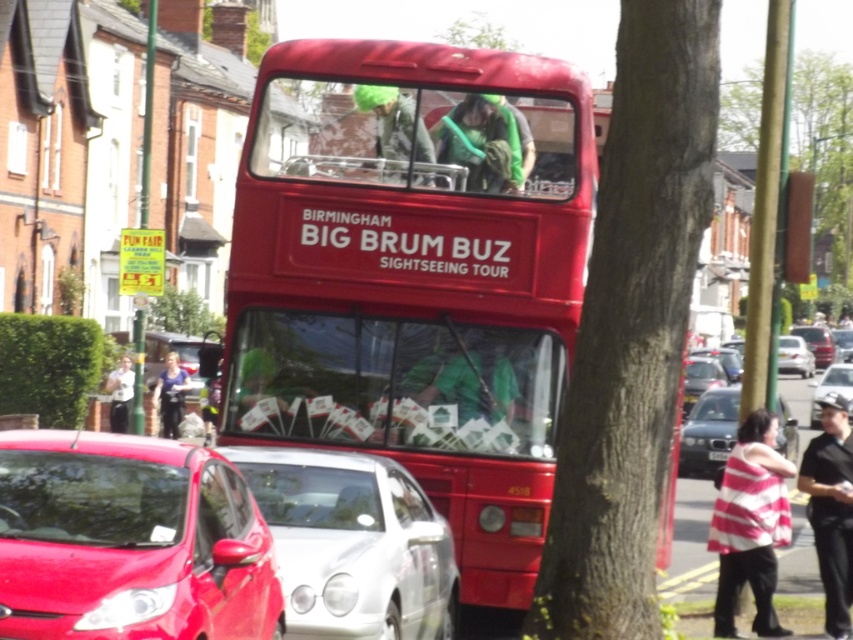
Question: Which is farther from the shiny silver car at center?

Choices:
 (A) metallic silver sedan at center
 (B) green leafy tree at center
 (C) shiny red bus at center

Answer: (B)

Question: Does silver metallic car at center have a greater width compared to shiny silver car at center?

Choices:
 (A) no
 (B) yes

Answer: (A)

Question: Is shiny red bus at center above silver metallic sedan at right?

Choices:
 (A) yes
 (B) no

Answer: (A)

Question: Observing the image, what is the correct spatial positioning of metallic silver sedan at center in reference to silver metallic sedan at right?

Choices:
 (A) above
 (B) below

Answer: (B)

Question: Which object appears farthest from the camera in this image?

Choices:
 (A) silver metallic sedan at right
 (B) shiny red bus at center
 (C) green leafy tree at center

Answer: (C)

Question: Which of the following is the closest to the observer?

Choices:
 (A) smooth bark tree at center
 (B) shiny silver car at center
 (C) metallic silver sedan at center
 (D) shiny red car at lower left

Answer: (D)